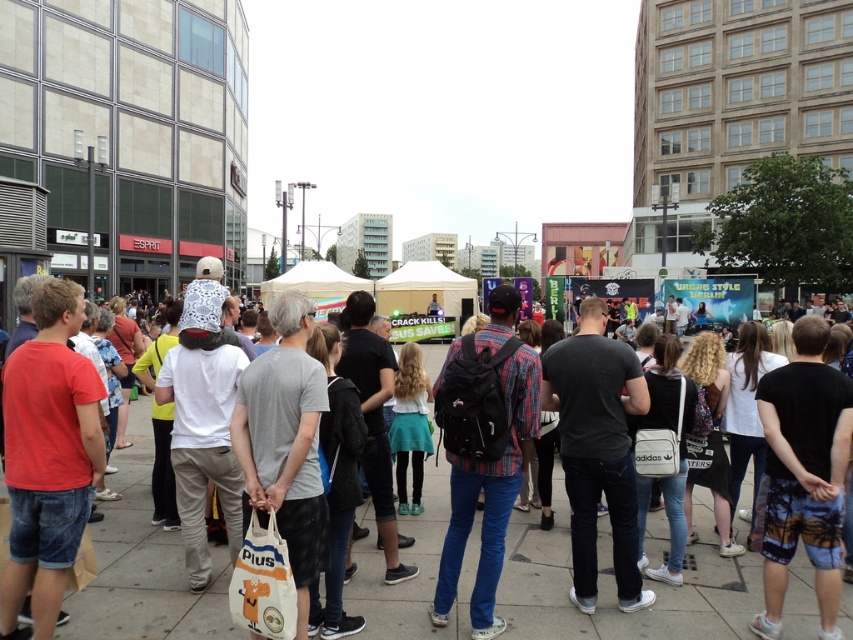
Can you confirm if white cotton shirt at center is shorter than dark gray t-shirt at center?

Yes.

Does white cotton shirt at center have a greater height compared to dark gray t-shirt at center?

Incorrect, white cotton shirt at center's height is not larger of dark gray t-shirt at center's.

Describe the element at coordinates (614, 586) in the screenshot. I see `white cotton shirt at center` at that location.

Locate an element on the screen. The image size is (853, 640). white cotton shirt at center is located at coordinates (614, 586).

Who is positioned more to the left, plaid fabric shirt at center or dark gray t-shirt at center?

From the viewer's perspective, plaid fabric shirt at center appears more on the left side.

The width and height of the screenshot is (853, 640). Describe the element at coordinates (485, 449) in the screenshot. I see `plaid fabric shirt at center` at that location.

The height and width of the screenshot is (640, 853). In order to click on plaid fabric shirt at center in this screenshot , I will do `click(485, 449)`.

Locate an element on the screen. The width and height of the screenshot is (853, 640). plaid fabric shirt at center is located at coordinates (485, 449).

Which is more to the right, white cotton shirt at center or plaid fabric shirt at center?

plaid fabric shirt at center is more to the right.

Which of these two, white cotton shirt at center or plaid fabric shirt at center, stands taller?

plaid fabric shirt at center

Identify the location of white cotton shirt at center. Image resolution: width=853 pixels, height=640 pixels. (614, 586).